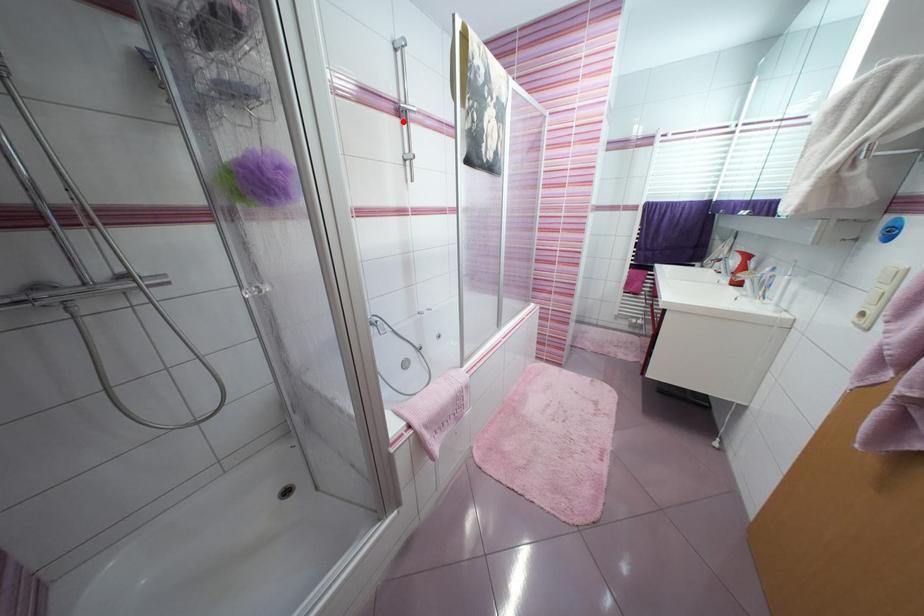
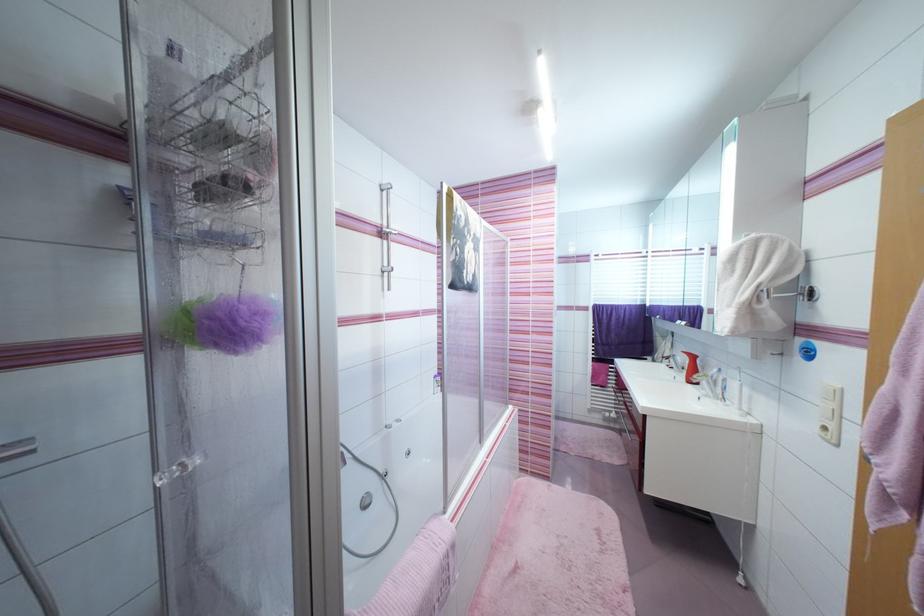
Find the pixel in the second image that matches the highlighted location in the first image.

(383, 241)